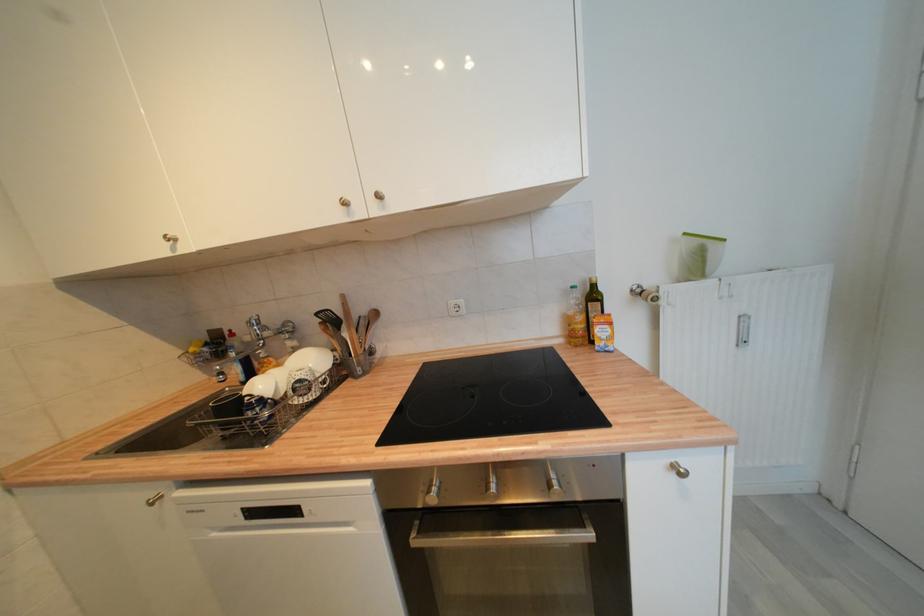
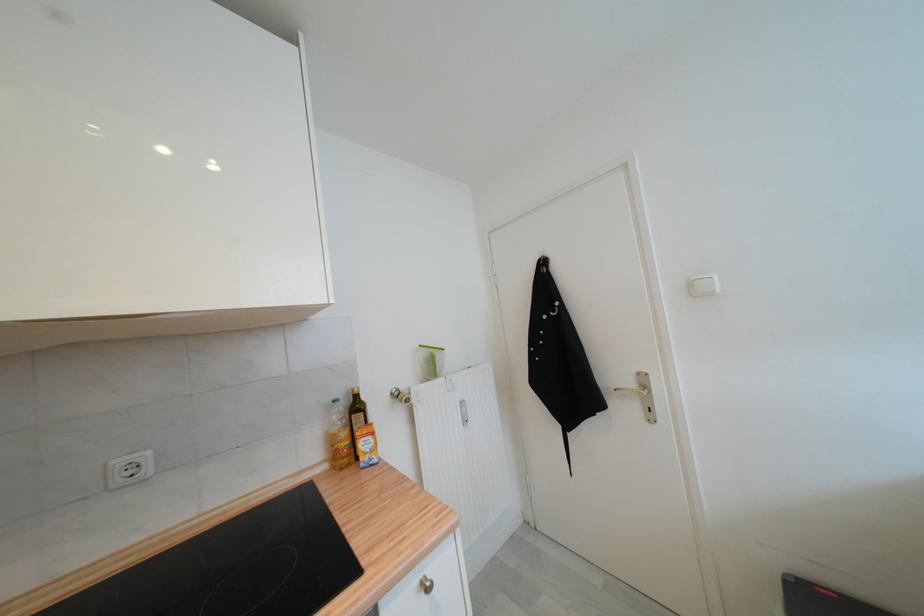
Find the pixel in the second image that matches [594,281] in the first image.

(358, 392)